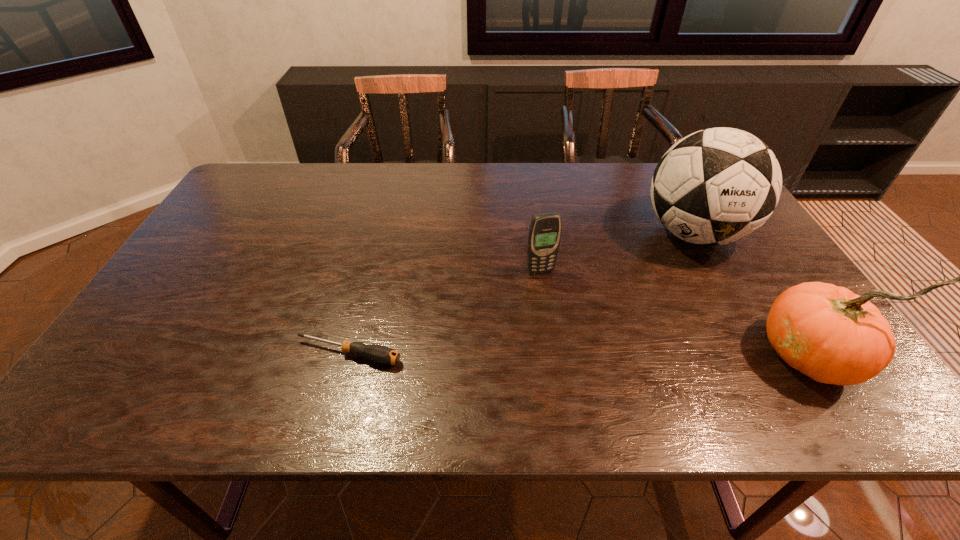
In order to click on free space on the desktop that is between the leftmost object and the pumpkin and is positioned on the surface of the soccer ball where the brand logo is visible in this screenshot , I will do `click(597, 355)`.

The width and height of the screenshot is (960, 540). Find the location of `vacant space on the desktop that is between the screwdriver and the pumpkin and is positioned on the screen of the second object from left to right`. vacant space on the desktop that is between the screwdriver and the pumpkin and is positioned on the screen of the second object from left to right is located at coordinates (576, 354).